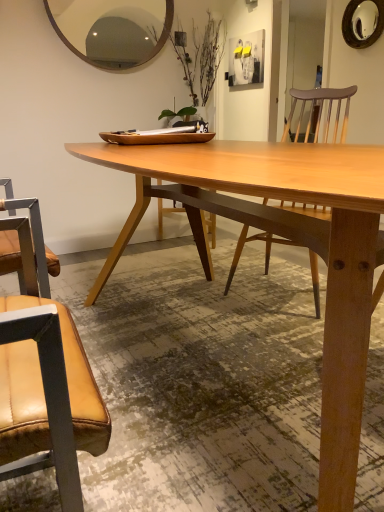
Question: Is leather at left facing away from natural wood table at center?

Choices:
 (A) yes
 (B) no

Answer: (B)

Question: Considering the relative positions of leather at left and natural wood table at center in the image provided, is leather at left to the left of natural wood table at center from the viewer's perspective?

Choices:
 (A) no
 (B) yes

Answer: (B)

Question: Can you confirm if leather at left is positioned to the right of natural wood table at center?

Choices:
 (A) yes
 (B) no

Answer: (B)

Question: Could natural wood table at center be considered to be inside leather at left?

Choices:
 (A) yes
 (B) no

Answer: (B)

Question: Are leather at left and natural wood table at center making contact?

Choices:
 (A) no
 (B) yes

Answer: (A)

Question: From the image's perspective, relative to leather at left, is matte white picture frame at upper center above or below?

Choices:
 (A) below
 (B) above

Answer: (B)

Question: Is matte white picture frame at upper center to the left or to the right of leather at left in the image?

Choices:
 (A) right
 (B) left

Answer: (A)

Question: Does point (240, 69) appear closer or farther from the camera than point (41, 434)?

Choices:
 (A) farther
 (B) closer

Answer: (A)

Question: Would you say matte white picture frame at upper center is inside or outside leather at left?

Choices:
 (A) inside
 (B) outside

Answer: (B)

Question: From the image's perspective, relative to matte white picture frame at upper center, is leather at left above or below?

Choices:
 (A) below
 (B) above

Answer: (A)

Question: Is point click(x=46, y=302) positioned closer to the camera than point click(x=241, y=58)?

Choices:
 (A) farther
 (B) closer

Answer: (B)

Question: Visually, is leather at left positioned to the left or to the right of matte white picture frame at upper center?

Choices:
 (A) right
 (B) left

Answer: (B)

Question: Relative to matte white picture frame at upper center, is leather at left in front or behind?

Choices:
 (A) behind
 (B) front

Answer: (B)

Question: In terms of width, does wooden mirror at upper center, the second mirror in the right-to-left sequence, look wider or thinner when compared to leather at left?

Choices:
 (A) wide
 (B) thin

Answer: (B)

Question: Is wooden mirror at upper center, the first mirror in the bottom-to-top sequence, in front of or behind leather at left in the image?

Choices:
 (A) behind
 (B) front

Answer: (A)